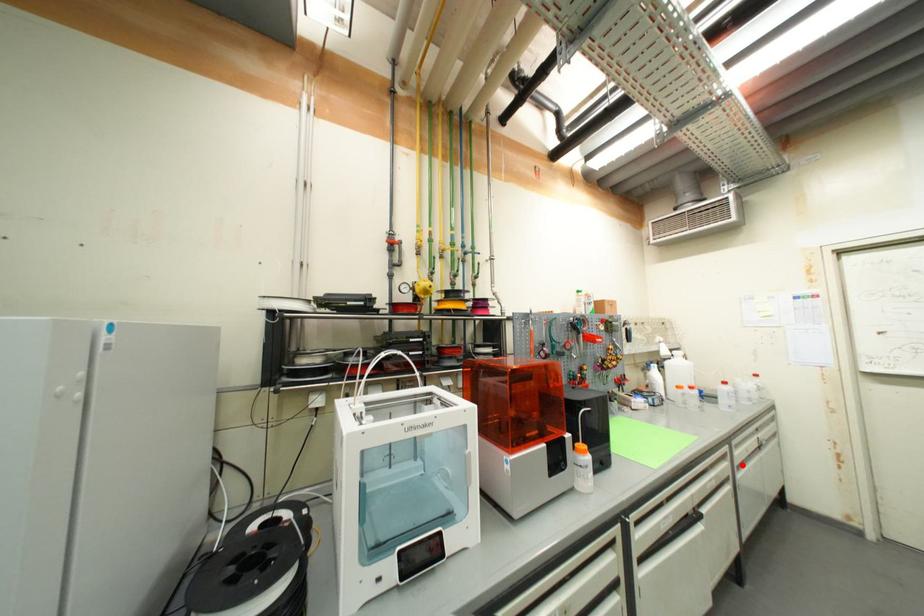
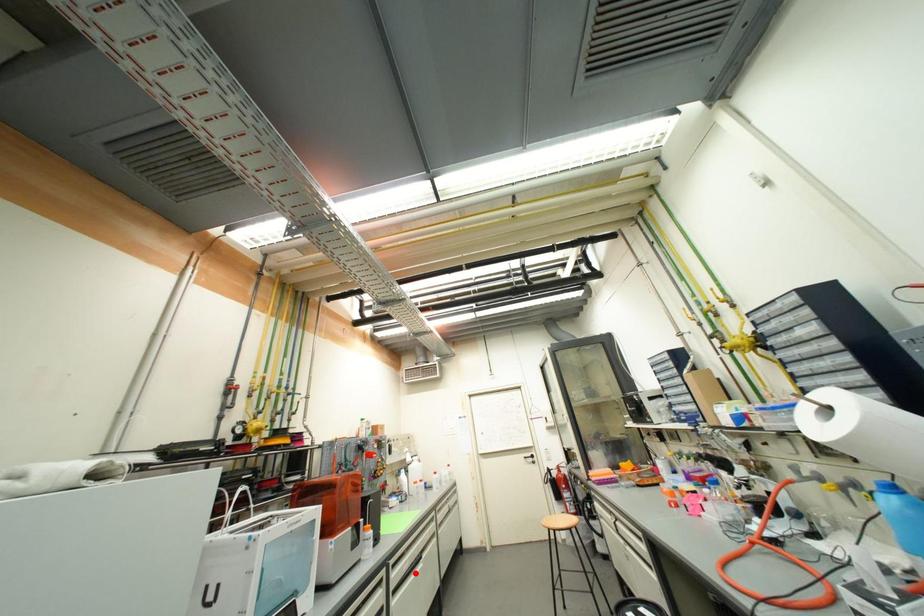
I am providing you with two images of the same scene from different viewpoints. A red point is marked on the first image and another point is marked on the second image. Are the points marked in image1 and image2 representing the same 3D position?

No